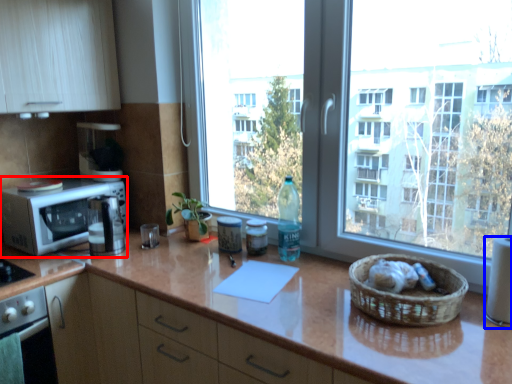
Question: Which object is further to the camera taking this photo, microwave oven (highlighted by a red box) or appliance (highlighted by a blue box)?

Choices:
 (A) microwave oven
 (B) appliance

Answer: (A)